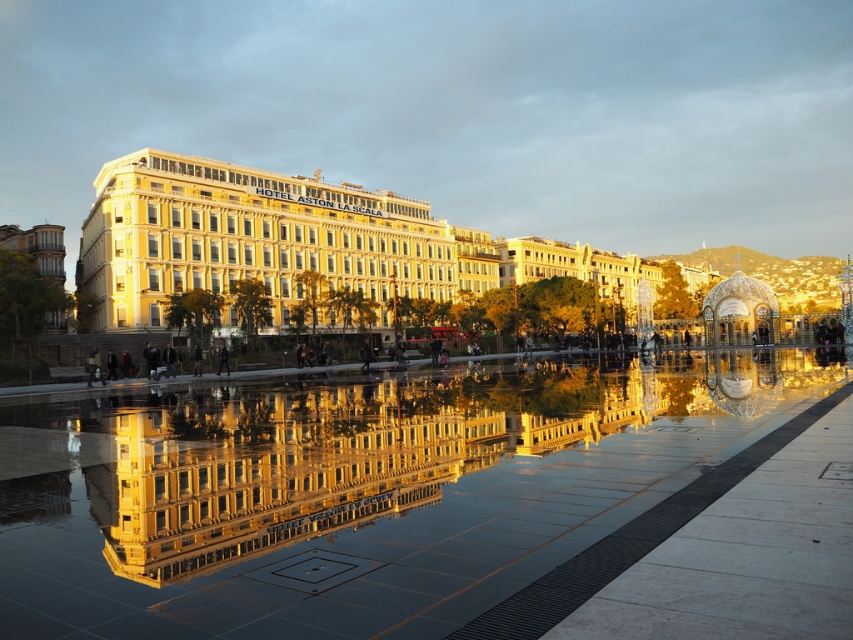
Question: Is glossy reflective water at center positioned at the back of golden stone building at center?

Choices:
 (A) yes
 (B) no

Answer: (B)

Question: Can you confirm if glossy reflective water at center is smaller than golden stone building at center?

Choices:
 (A) no
 (B) yes

Answer: (B)

Question: Is glossy reflective water at center closer to camera compared to golden stone building at center?

Choices:
 (A) no
 (B) yes

Answer: (B)

Question: Which of the following is the closest to the observer?

Choices:
 (A) (608, 504)
 (B) (155, 250)

Answer: (A)